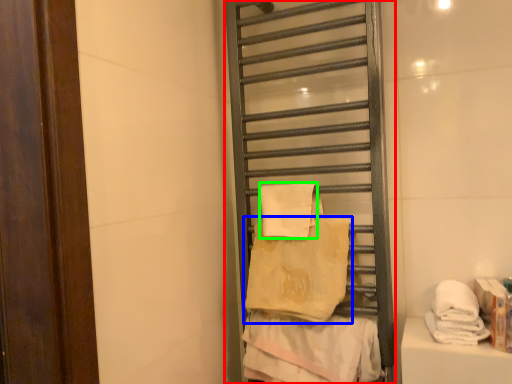
Question: Considering the real-world distances, which object is closest to shelf (highlighted by a red box)? towel (highlighted by a blue box) or towel (highlighted by a green box).

Choices:
 (A) towel
 (B) towel

Answer: (A)